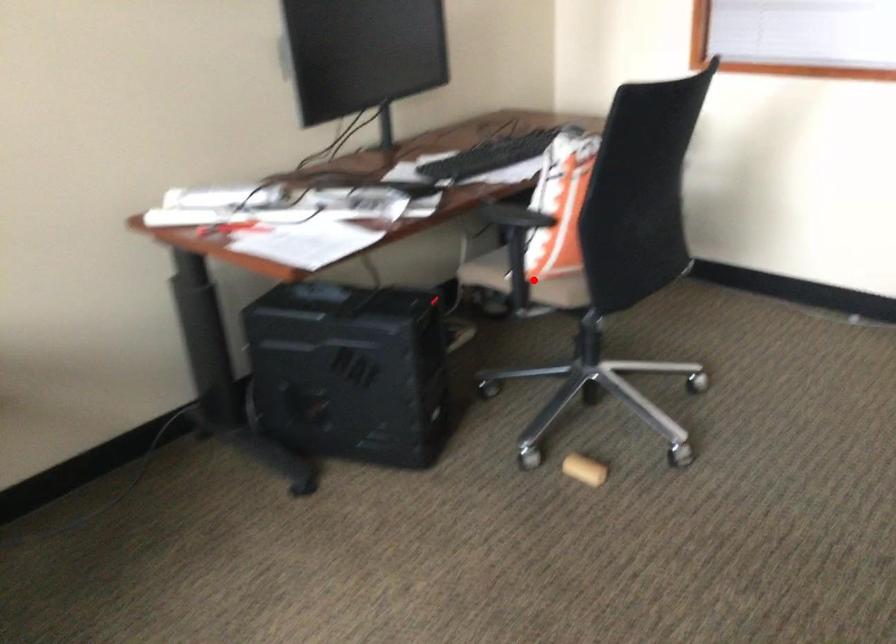
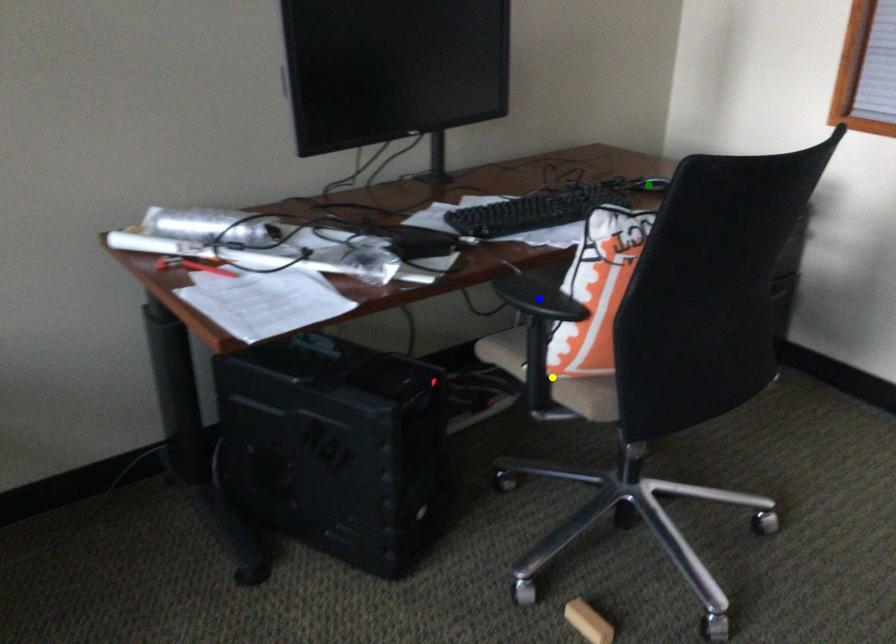
Question: I am providing you with two images of the same scene from different viewpoints. A red point is marked on the first image. You are given multiple points on the second image. In image 2, which mark is for the same physical point as the one in image 1?

Choices:
 (A) yellow point
 (B) green point
 (C) blue point

Answer: (A)